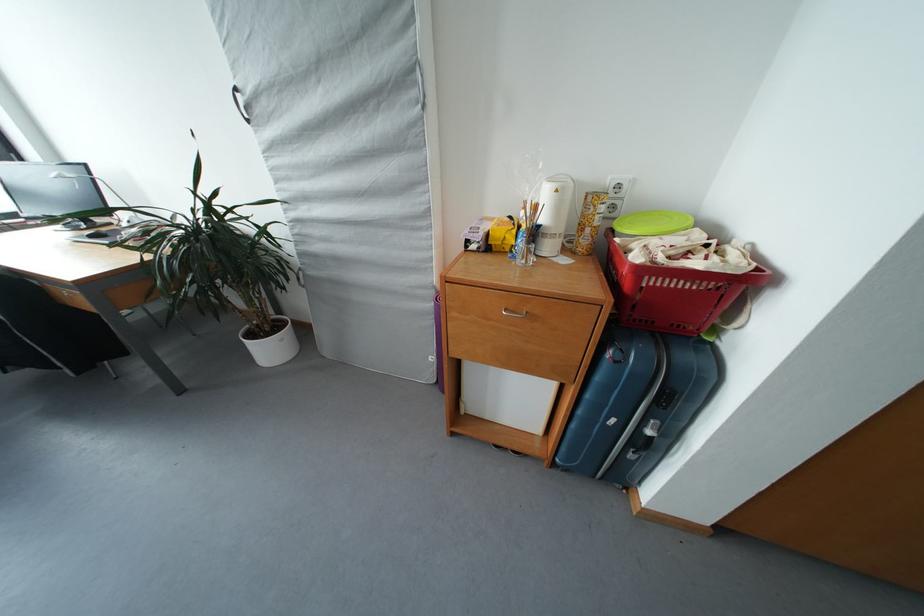
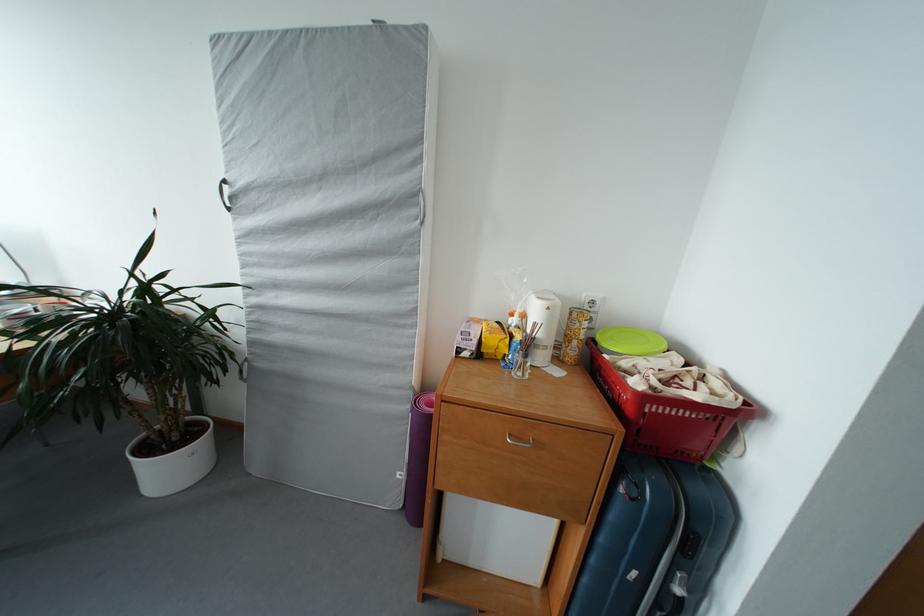
The images are taken continuously from a first-person perspective. In which direction are you moving?

The cameraman walked toward left, forward.